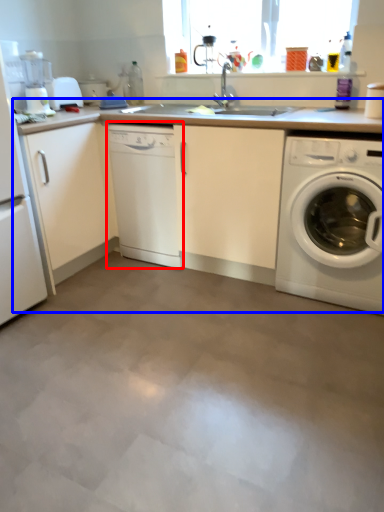
Question: Which object appears farthest to the camera in this image, dish washer (highlighted by a red box) or counter top (highlighted by a blue box)?

Choices:
 (A) dish washer
 (B) counter top

Answer: (A)